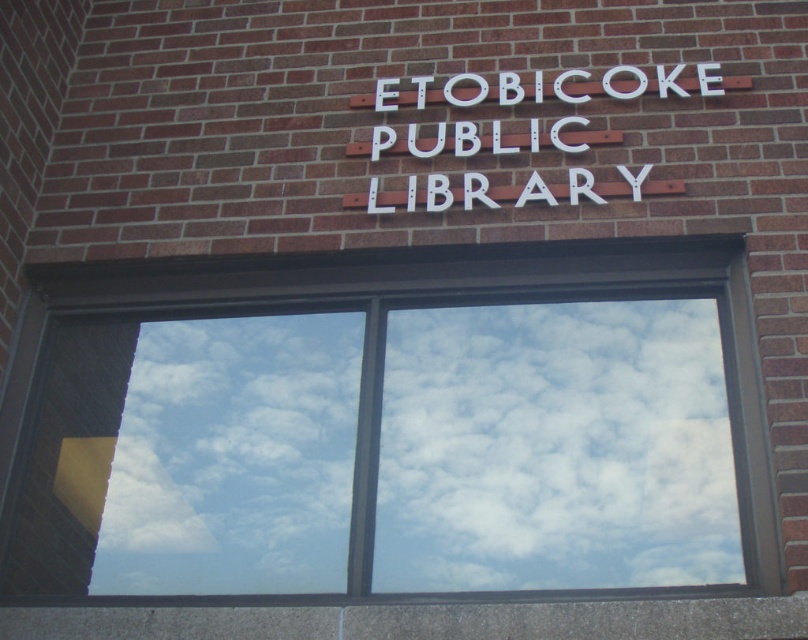
You are a delivery person holding a package that is 30 inches long. You need to place it horizontally between the transparent glass window at center and the white painted wood sign at center. Is there enough space for the package?

The transparent glass window at center is 29.12 inches from the white painted wood sign at center. Since the package is 30 inches long, it will not fit between them as the distance is slightly shorter than the package length.

You are standing in front of the Etobicoke Public Library and want to touch both the transparent glass window at center and the white painted wood sign at center. Which object will you reach first?

You will reach the transparent glass window at center first because it is closer to the viewer than the white painted wood sign at center.